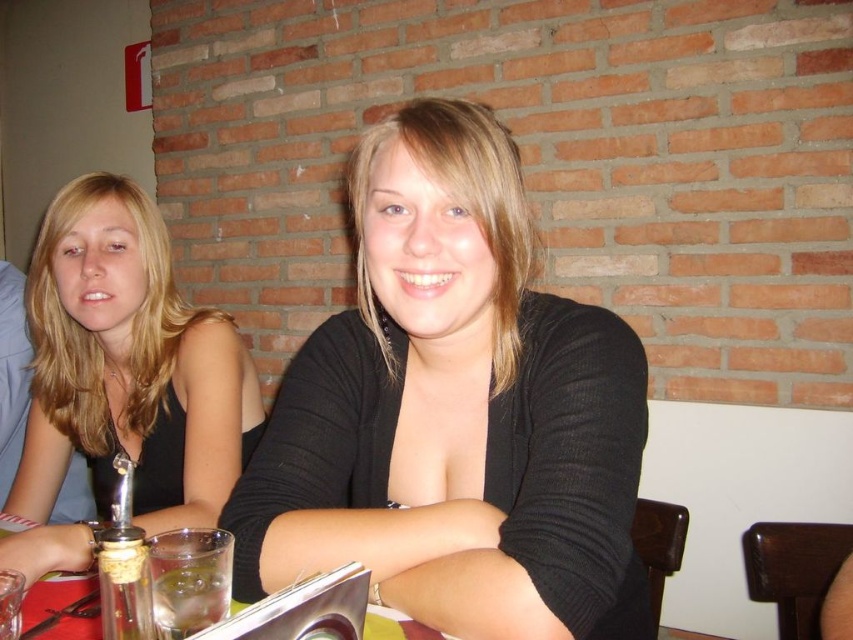
Can you confirm if matte black tank top at left is positioned to the right of clear glass at lower center?

Incorrect, matte black tank top at left is not on the right side of clear glass at lower center.

Can you confirm if matte black tank top at left is thinner than clear glass at lower center?

Incorrect, matte black tank top at left's width is not less than clear glass at lower center's.

Which is behind, point (9, 547) or point (62, 602)?

The point (9, 547) is behind.

Locate an element on the screen. This screenshot has width=853, height=640. matte black tank top at left is located at coordinates (123, 378).

Is black matte sweater at center above clear glass at lower center?

Indeed, black matte sweater at center is positioned over clear glass at lower center.

Between point (393, 145) and point (97, 627), which one is positioned behind?

Positioned behind is point (393, 145).

Does point (456, 388) come behind point (55, 593)?

Yes, it is behind point (55, 593).

The height and width of the screenshot is (640, 853). I want to click on black matte sweater at center, so click(x=454, y=412).

At what (x,y) coordinates should I click in order to perform the action: click on black matte sweater at center. Please return your answer as a coordinate pair (x, y). This screenshot has height=640, width=853. Looking at the image, I should click on (454, 412).

Who is more distant from viewer, [561,369] or [65,369]?

Point [65,369]

Image resolution: width=853 pixels, height=640 pixels. What do you see at coordinates (454, 412) in the screenshot?
I see `black matte sweater at center` at bounding box center [454, 412].

Identify the location of black matte sweater at center. The height and width of the screenshot is (640, 853). (454, 412).